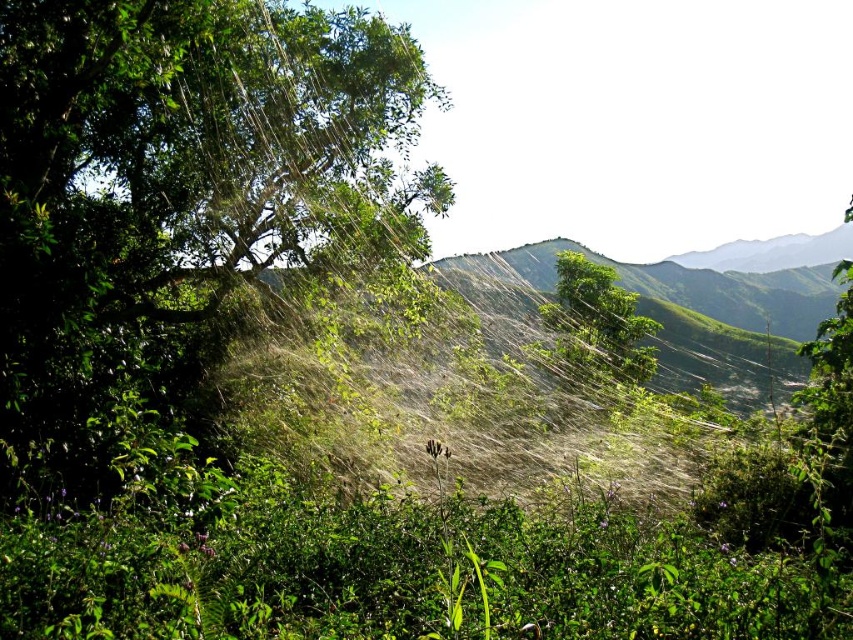
Does point (80, 474) come closer to viewer compared to point (611, 280)?

Yes, point (80, 474) is closer to viewer.

Which is in front, point (169, 269) or point (643, 324)?

Point (169, 269) is in front.

At what (x,y) coordinates should I click in order to perform the action: click on green leafy tree at upper left. Please return your answer as a coordinate pair (x, y). The image size is (853, 640). Looking at the image, I should click on (178, 195).